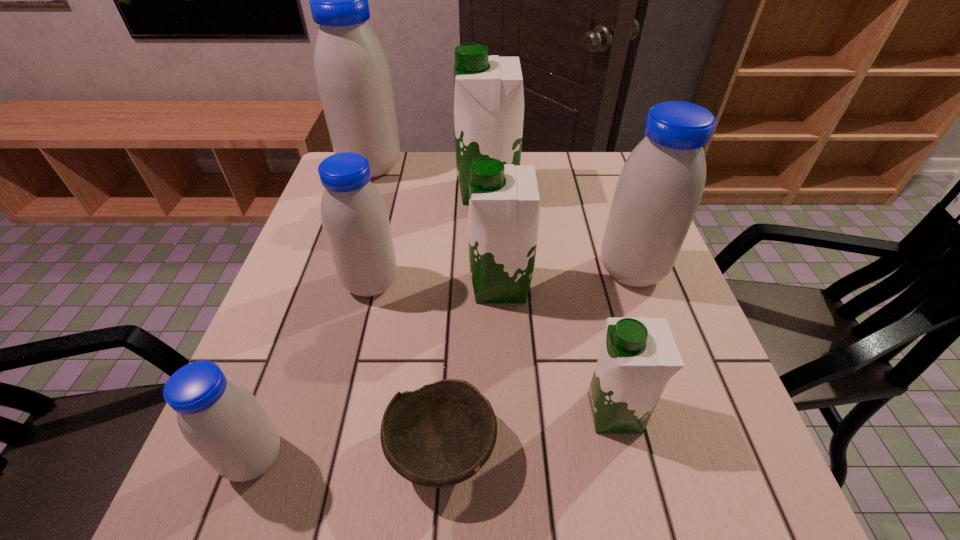
Where is `vacant space located on the front-facing side of the rightmost green soya milk`? Image resolution: width=960 pixels, height=540 pixels. vacant space located on the front-facing side of the rightmost green soya milk is located at coordinates (451, 412).

Where is `vacant space located on the front-facing side of the rightmost green soya milk`? vacant space located on the front-facing side of the rightmost green soya milk is located at coordinates (371, 412).

The height and width of the screenshot is (540, 960). Identify the location of vacant space situated on the back of the smallest blue soya milk. (322, 274).

This screenshot has width=960, height=540. Find the location of `free spot located on the back of the bowl`. free spot located on the back of the bowl is located at coordinates (450, 313).

In order to click on soya milk that is at the near edge in this screenshot , I will do `click(220, 418)`.

This screenshot has width=960, height=540. I want to click on bowl located in the near edge section of the desktop, so click(x=442, y=434).

This screenshot has width=960, height=540. Find the location of `object that is at the far left corner`. object that is at the far left corner is located at coordinates (352, 73).

In order to click on object situated at the near left corner in this screenshot , I will do `click(220, 418)`.

Where is `vacant region at the far edge of the desktop`? The image size is (960, 540). vacant region at the far edge of the desktop is located at coordinates (564, 154).

Where is `vacant space at the near edge`? vacant space at the near edge is located at coordinates (350, 487).